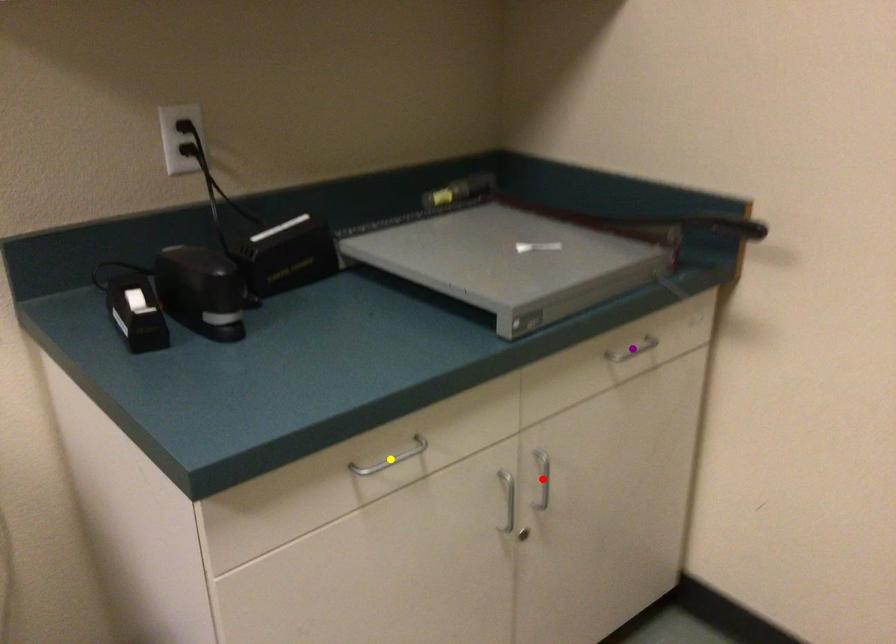
Order these from nearest to farthest:
red point
purple point
yellow point

yellow point → red point → purple point